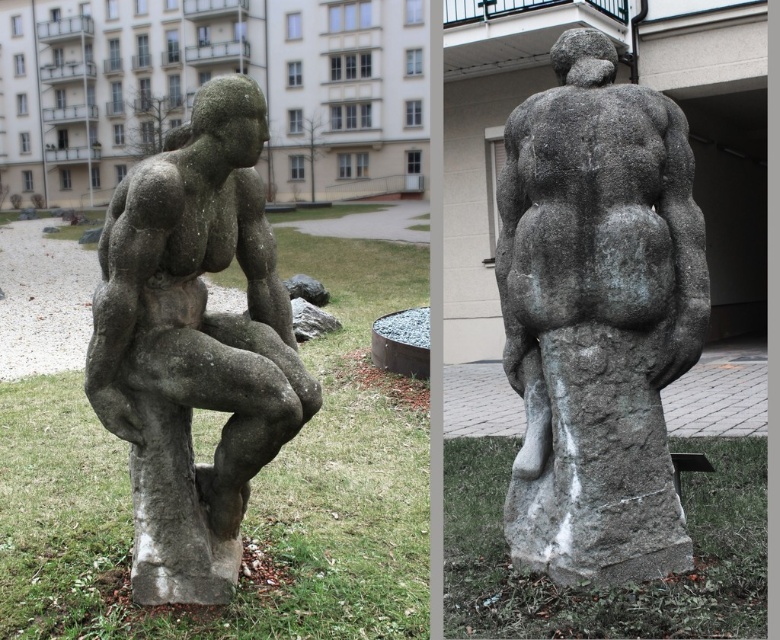
Question: Which object is farther from the camera taking this photo?

Choices:
 (A) gray stone statue at center
 (B) gray stone statue at left

Answer: (A)

Question: Considering the relative positions of gray stone statue at center and gray stone statue at left in the image provided, where is gray stone statue at center located with respect to gray stone statue at left?

Choices:
 (A) left
 (B) right

Answer: (B)

Question: Can you confirm if gray stone statue at center is positioned above gray stone statue at left?

Choices:
 (A) yes
 (B) no

Answer: (A)

Question: Is gray stone statue at center positioned at the back of gray stone statue at left?

Choices:
 (A) yes
 (B) no

Answer: (A)